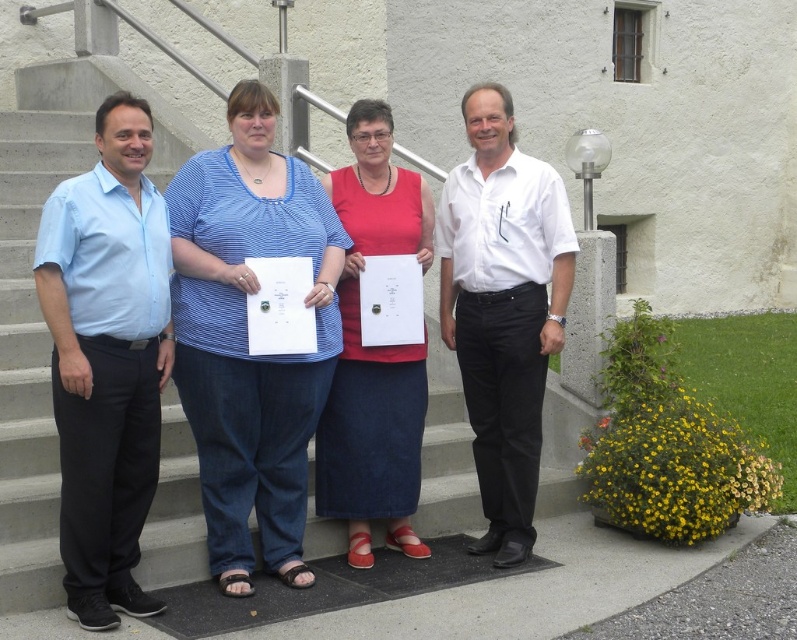
Is blue striped shirt at center above light blue cotton shirt at left?

Indeed, blue striped shirt at center is positioned over light blue cotton shirt at left.

This screenshot has height=640, width=797. Describe the element at coordinates (246, 337) in the screenshot. I see `blue striped shirt at center` at that location.

Where is `blue striped shirt at center`? The height and width of the screenshot is (640, 797). blue striped shirt at center is located at coordinates (246, 337).

Which is above, concrete stairs at center or white smooth shirt at center?

concrete stairs at center is above.

Who is positioned more to the right, concrete stairs at center or white smooth shirt at center?

white smooth shirt at center

Is point (250, 522) closer to viewer compared to point (499, 428)?

Yes, point (250, 522) is closer to viewer.

I want to click on concrete stairs at center, so click(x=34, y=300).

Is blue striped shirt at center above white smooth shirt at center?

No, blue striped shirt at center is not above white smooth shirt at center.

Does blue striped shirt at center have a greater width compared to white smooth shirt at center?

Indeed, blue striped shirt at center has a greater width compared to white smooth shirt at center.

Does point (238, 236) come behind point (491, 176)?

No, (238, 236) is in front of (491, 176).

Image resolution: width=797 pixels, height=640 pixels. Identify the location of blue striped shirt at center. (246, 337).